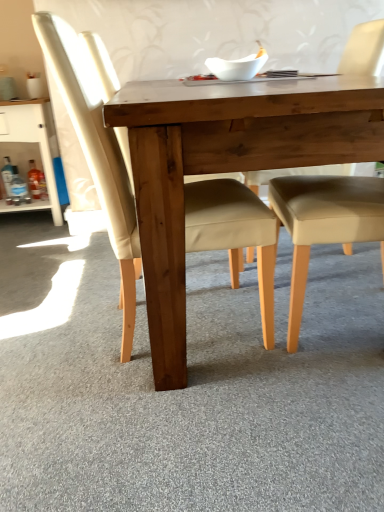
Image resolution: width=384 pixels, height=512 pixels. Describe the element at coordinates (226, 166) in the screenshot. I see `natural wood table at center` at that location.

What do you see at coordinates (33, 143) in the screenshot? I see `white glossy cabinet at left` at bounding box center [33, 143].

This screenshot has width=384, height=512. I want to click on matte wood chair at center, placed as the second chair when sorted from right to left, so click(x=96, y=151).

At what (x,y) coordinates should I click in order to perform the action: click on beige leather chair at center, acting as the first chair starting from the right. Please return your answer as a coordinate pair (x, y). The image size is (384, 512). Looking at the image, I should click on (364, 49).

Is matte wood chair at center, which is the 1th chair from left to right, next to white glossy cabinet at left?

No, matte wood chair at center, which is the 1th chair from left to right, is not with white glossy cabinet at left.

Considering the sizes of objects matte wood chair at center, which is the 1th chair from left to right, and white glossy cabinet at left in the image provided, who is smaller, matte wood chair at center, which is the 1th chair from left to right, or white glossy cabinet at left?

Smaller between the two is white glossy cabinet at left.

Which is in front, point (262, 264) or point (53, 198)?

The point (262, 264) is in front.

Considering the positions of objects matte wood chair at center, placed as the second chair when sorted from right to left, and white glossy cabinet at left in the image provided, who is behind, matte wood chair at center, placed as the second chair when sorted from right to left, or white glossy cabinet at left?

white glossy cabinet at left is further from the camera.

From the image's perspective, relative to beige leather chair at center, marked as the second chair in a left-to-right arrangement, is white glossy cabinet at left above or below?

white glossy cabinet at left is above beige leather chair at center, marked as the second chair in a left-to-right arrangement.

Starting from the white glossy cabinet at left, which chair is the 1st one in front? Please provide its 2D coordinates.

[(364, 49)]

Is white glossy cabinet at left in front of beige leather chair at center, acting as the first chair starting from the right?

That is False.

Is white glossy cabinet at left facing away from beige leather chair at center, marked as the second chair in a left-to-right arrangement?

No, white glossy cabinet at left is not facing away from beige leather chair at center, marked as the second chair in a left-to-right arrangement.

How many degrees apart are the facing directions of white glossy cabinet at left and natural wood table at center?

white glossy cabinet at left and natural wood table at center are facing 0.208 degrees away from each other.

From a real-world perspective, which object stands above the other?

From a 3D spatial view, natural wood table at center is above.

Consider the image. From the image's perspective, does white glossy cabinet at left appear lower than natural wood table at center?

Actually, white glossy cabinet at left appears above natural wood table at center in the image.

Between natural wood table at center and matte wood chair at center, placed as the second chair when sorted from right to left, which one has smaller width?

With smaller width is matte wood chair at center, placed as the second chair when sorted from right to left.

Measure the distance from natural wood table at center to matte wood chair at center, which is the 1th chair from left to right.

They are 23.80 centimeters apart.

Is matte wood chair at center, placed as the second chair when sorted from right to left, completely or partially inside natural wood table at center?

Yes, matte wood chair at center, placed as the second chair when sorted from right to left, is inside natural wood table at center.

Which chair is the 1st one when counting from the back of the natural wood table at center? Please provide its 2D coordinates.

[(96, 151)]

Between matte wood chair at center, which is the 1th chair from left to right, and natural wood table at center, which one has smaller size?

matte wood chair at center, which is the 1th chair from left to right, is smaller.

Is matte wood chair at center, placed as the second chair when sorted from right to left, positioned before natural wood table at center?

No, matte wood chair at center, placed as the second chair when sorted from right to left, is further to the viewer.

From a real-world perspective, who is located lower, matte wood chair at center, placed as the second chair when sorted from right to left, or natural wood table at center?

In real-world perspective, natural wood table at center is lower.

Is matte wood chair at center, which is the 1th chair from left to right, taller than natural wood table at center?

Yes.

Is beige leather chair at center, acting as the first chair starting from the right, thinner than white glossy cabinet at left?

In fact, beige leather chair at center, acting as the first chair starting from the right, might be wider than white glossy cabinet at left.

Consider the image. From the image's perspective, is beige leather chair at center, acting as the first chair starting from the right, positioned above or below white glossy cabinet at left?

beige leather chair at center, acting as the first chair starting from the right, is below white glossy cabinet at left.

Which object is closer to the camera taking this photo, beige leather chair at center, acting as the first chair starting from the right, or white glossy cabinet at left?

beige leather chair at center, acting as the first chair starting from the right, is more forward.

From a real-world perspective, which is physically below, beige leather chair at center, marked as the second chair in a left-to-right arrangement, or white glossy cabinet at left?

From a 3D spatial view, white glossy cabinet at left is below.

Which is correct: beige leather chair at center, acting as the first chair starting from the right, is inside matte wood chair at center, which is the 1th chair from left to right, or outside of it?

beige leather chair at center, acting as the first chair starting from the right, exists outside the volume of matte wood chair at center, which is the 1th chair from left to right.

From the image's perspective, is beige leather chair at center, marked as the second chair in a left-to-right arrangement, located above or below matte wood chair at center, placed as the second chair when sorted from right to left?

Based on their image positions, beige leather chair at center, marked as the second chair in a left-to-right arrangement, is located above matte wood chair at center, placed as the second chair when sorted from right to left.

Considering the positions of point (245, 173) and point (66, 75), is point (245, 173) closer or farther from the camera than point (66, 75)?

Point (245, 173).

From a real-world perspective, does beige leather chair at center, marked as the second chair in a left-to-right arrangement, sit lower than matte wood chair at center, placed as the second chair when sorted from right to left?

Indeed, from a real-world perspective, beige leather chair at center, marked as the second chair in a left-to-right arrangement, is positioned beneath matte wood chair at center, placed as the second chair when sorted from right to left.

Image resolution: width=384 pixels, height=512 pixels. In order to click on dresser above the matte wood chair at center, which is the 1th chair from left to right (from the image's perspective) in this screenshot , I will do `click(33, 143)`.

At what (x,y) coordinates should I click in order to perform the action: click on dresser below the beige leather chair at center, acting as the first chair starting from the right (from a real-world perspective). Please return your answer as a coordinate pair (x, y). Looking at the image, I should click on (33, 143).

Considering their positions, is beige leather chair at center, marked as the second chair in a left-to-right arrangement, positioned further to matte wood chair at center, which is the 1th chair from left to right, than natural wood table at center?

beige leather chair at center, marked as the second chair in a left-to-right arrangement, is positioned further to the anchor matte wood chair at center, which is the 1th chair from left to right.

From the picture: Estimate the real-world distances between objects in this image. Which object is further from white glossy cabinet at left, natural wood table at center or beige leather chair at center, acting as the first chair starting from the right?

The object further to white glossy cabinet at left is beige leather chair at center, acting as the first chair starting from the right.

Estimate the real-world distances between objects in this image. Which object is further from white glossy cabinet at left, beige leather chair at center, marked as the second chair in a left-to-right arrangement, or matte wood chair at center, placed as the second chair when sorted from right to left?

Based on the image, beige leather chair at center, marked as the second chair in a left-to-right arrangement, appears to be further to white glossy cabinet at left.

Based on the photo, when comparing their distances from matte wood chair at center, placed as the second chair when sorted from right to left, does natural wood table at center or white glossy cabinet at left seem closer?

Among the two, natural wood table at center is located nearer to matte wood chair at center, placed as the second chair when sorted from right to left.

Which object lies nearer to the anchor point beige leather chair at center, marked as the second chair in a left-to-right arrangement, matte wood chair at center, which is the 1th chair from left to right, or natural wood table at center?

Among the two, natural wood table at center is located nearer to beige leather chair at center, marked as the second chair in a left-to-right arrangement.

Considering their positions, is white glossy cabinet at left positioned closer to matte wood chair at center, placed as the second chair when sorted from right to left, than natural wood table at center?

Based on the image, natural wood table at center appears to be nearer to matte wood chair at center, placed as the second chair when sorted from right to left.

Looking at the image, which one is located further to white glossy cabinet at left, beige leather chair at center, marked as the second chair in a left-to-right arrangement, or natural wood table at center?

beige leather chair at center, marked as the second chair in a left-to-right arrangement, lies further to white glossy cabinet at left than the other object.

From the image, which object appears to be farther from natural wood table at center, matte wood chair at center, placed as the second chair when sorted from right to left, or white glossy cabinet at left?

The object further to natural wood table at center is white glossy cabinet at left.

What are the coordinates of `table located between white glossy cabinet at left and beige leather chair at center, marked as the second chair in a left-to-right arrangement, in the left-right direction` in the screenshot? It's located at (226, 166).

The width and height of the screenshot is (384, 512). In order to click on chair positioned between matte wood chair at center, which is the 1th chair from left to right, and white glossy cabinet at left from near to far in this screenshot , I will do `click(364, 49)`.

Where is `table between matte wood chair at center, placed as the second chair when sorted from right to left, and beige leather chair at center, acting as the first chair starting from the right, in the horizontal direction`? The height and width of the screenshot is (512, 384). table between matte wood chair at center, placed as the second chair when sorted from right to left, and beige leather chair at center, acting as the first chair starting from the right, in the horizontal direction is located at coordinates (226, 166).